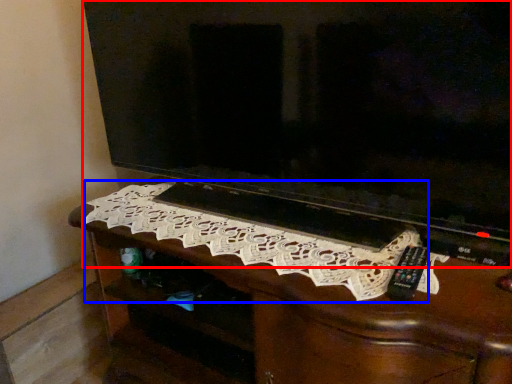
Question: Which of the following is the farthest to the observer, television (highlighted by a red box) or embroidery (highlighted by a blue box)?

Choices:
 (A) television
 (B) embroidery

Answer: (B)